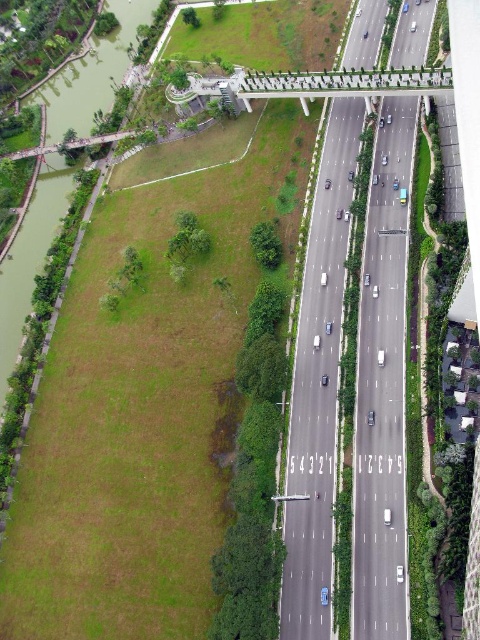
Question: Does asphalt road at center have a larger size compared to green grass at lower left?

Choices:
 (A) yes
 (B) no

Answer: (B)

Question: Does asphalt road at center lie behind green grass at lower left?

Choices:
 (A) no
 (B) yes

Answer: (A)

Question: Is asphalt road at center further to camera compared to green grass at lower left?

Choices:
 (A) no
 (B) yes

Answer: (A)

Question: Which of the following is the farthest from the observer?

Choices:
 (A) (308, 573)
 (B) (57, 113)

Answer: (B)